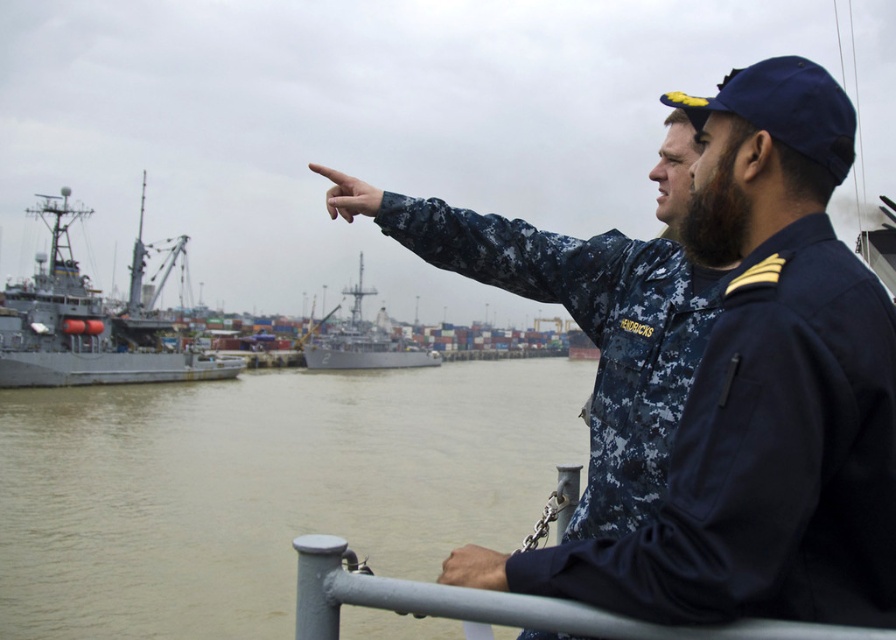
Which is more to the right, brown murky water at center or gray metallic ship at left?

brown murky water at center

You are a GUI agent. You are given a task and a screenshot of the screen. Output one action in this format:
    pyautogui.click(x=<x>, y=<y>)
    Task: Click on the brown murky water at center
    Image resolution: width=896 pixels, height=640 pixels.
    Given the screenshot: What is the action you would take?
    pyautogui.click(x=263, y=488)

Which is in front, point (629, 525) or point (584, 616)?

Point (584, 616) is more forward.

Can you confirm if digital camouflage uniform at upper right is smaller than gray metallic rail at lower center?

No.

Is point (645, 285) closer to camera compared to point (618, 616)?

No.

At what (x,y) coordinates should I click in order to perform the action: click on digital camouflage uniform at upper right. Please return your answer as a coordinate pair (x, y). Looking at the image, I should click on (591, 333).

Which is more to the right, digital camouflage uniform at upper right or gray metallic ship at center?

Positioned to the right is digital camouflage uniform at upper right.

Who is higher up, digital camouflage uniform at upper right or gray metallic ship at center?

Positioned higher is digital camouflage uniform at upper right.

What do you see at coordinates (591, 333) in the screenshot?
I see `digital camouflage uniform at upper right` at bounding box center [591, 333].

Locate an element on the screen. Image resolution: width=896 pixels, height=640 pixels. digital camouflage uniform at upper right is located at coordinates (591, 333).